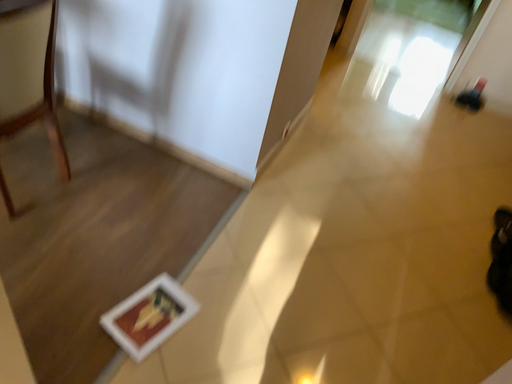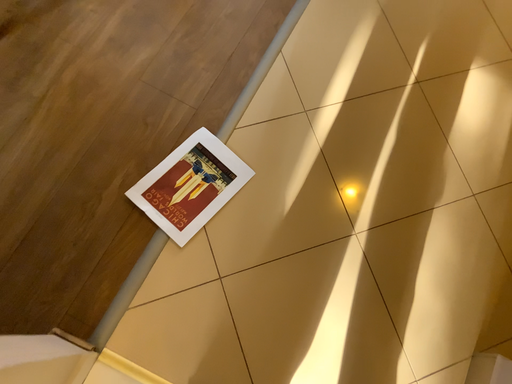
Question: Which way did the camera rotate in the video?

Choices:
 (A) rotated upward
 (B) rotated downward

Answer: (B)